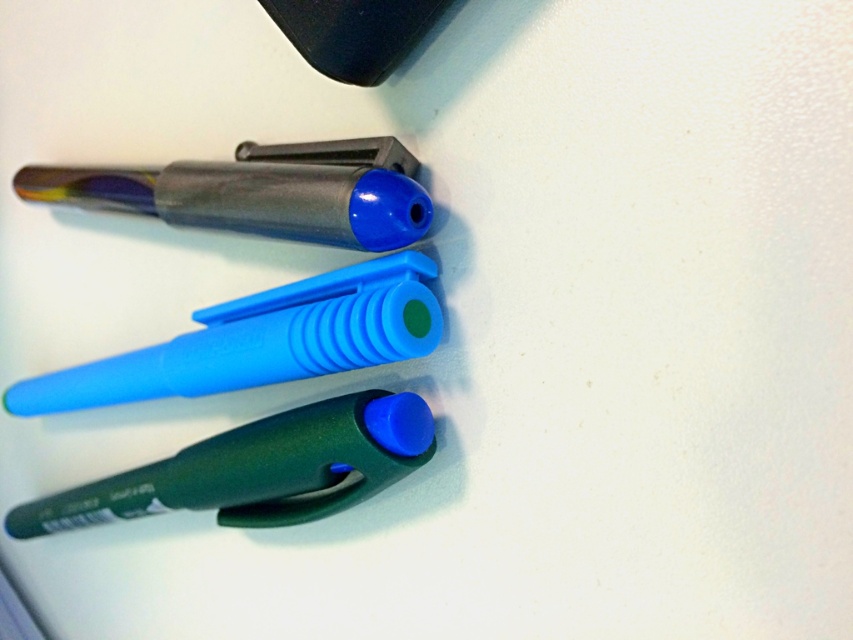
Measure the distance between point (381, 316) and camera.

They are 34.50 inches apart.

The width and height of the screenshot is (853, 640). What do you see at coordinates (260, 340) in the screenshot?
I see `translucent blue pen at center` at bounding box center [260, 340].

Is point (236, 381) more distant than point (409, 417)?

Yes, it is behind point (409, 417).

What are the coordinates of `translucent blue pen at center` in the screenshot? It's located at (260, 340).